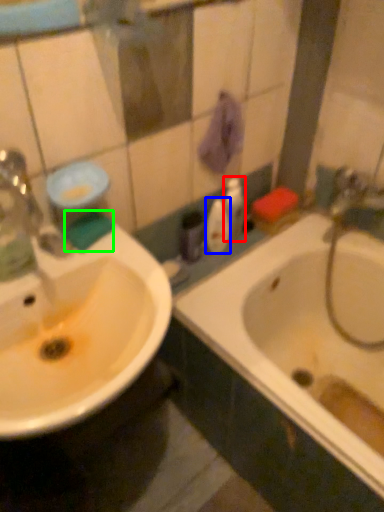
Question: Which object is the farthest from toiletry (highlighted by a red box)? Choose among these: mouthwash (highlighted by a blue box) or liquid (highlighted by a green box).

Choices:
 (A) mouthwash
 (B) liquid

Answer: (B)